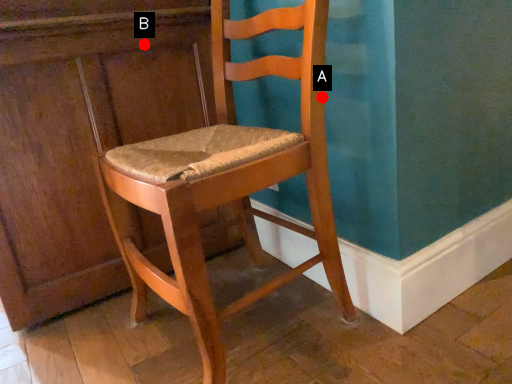
Question: Two points are circled on the image, labeled by A and B beside each circle. Which point is closer to the camera?

Choices:
 (A) A is closer
 (B) B is closer

Answer: (A)